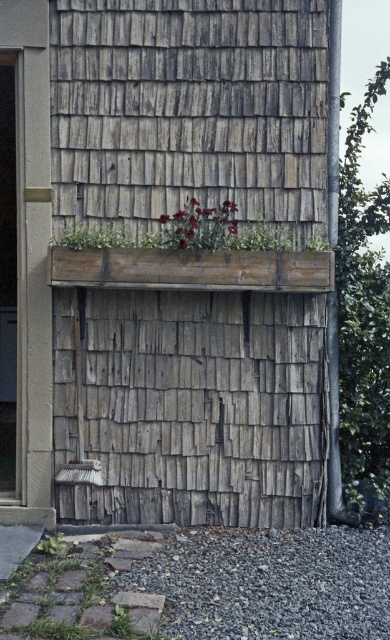
You are a gardener looking at the house exterior. You see the green leafy plant at right and the green matte planter at center. Which one is positioned lower on the wall?

The green leafy plant at right is positioned lower on the wall than the green matte planter at center.

You are a gardener assessing the plants on the exterior wall. You notice the green leafy plant at right and the green matte planter at center. Which object has a larger size?

The green leafy plant at right is bigger than the green matte planter at center.

You are a gardener who wants to water the green leafy plant at right and the deep red petals at center. If you are standing at the base of the wall, which plant should you water first to minimize your walking distance?

The deep red petals at center should be watered first because the green leafy plant at right is 33.89 inches away from it, so watering the closer one first reduces the total distance walked.